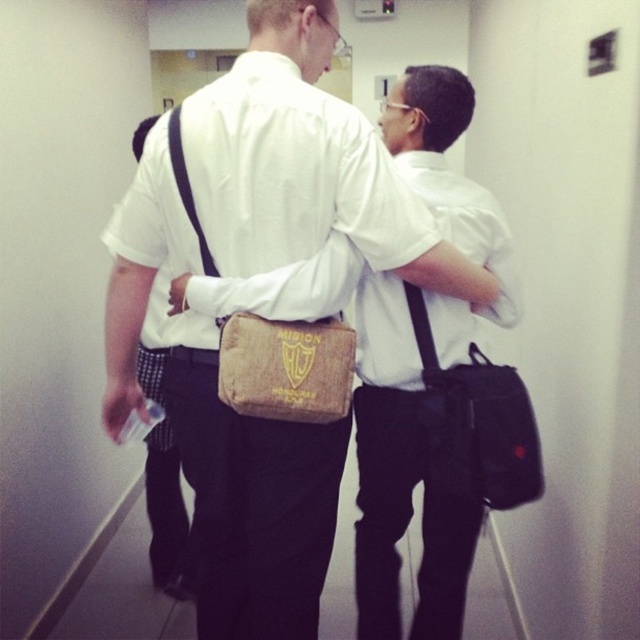
Is brown canvas bag at center wider than black fabric messenger bag at right?

Yes, brown canvas bag at center is wider than black fabric messenger bag at right.

Describe the element at coordinates (220, 435) in the screenshot. The width and height of the screenshot is (640, 640). I see `brown canvas bag at center` at that location.

This screenshot has height=640, width=640. In order to click on brown canvas bag at center in this screenshot , I will do `click(220, 435)`.

From the picture: Between white woven bag at center and matte brown bag at center, which one has more height?

Standing taller between the two is matte brown bag at center.

Between white woven bag at center and matte brown bag at center, which one is positioned higher?

white woven bag at center is above.

The width and height of the screenshot is (640, 640). I want to click on white woven bag at center, so click(x=291, y=172).

Which is more to the right, white woven bag at center or brown canvas pouch at center?

Positioned to the right is brown canvas pouch at center.

Is white woven bag at center thinner than brown canvas pouch at center?

Incorrect, white woven bag at center's width is not less than brown canvas pouch at center's.

Is point (330, 160) positioned after point (321, 416)?

No, it is in front of (321, 416).

Find the location of a particular element. This screenshot has width=640, height=640. white woven bag at center is located at coordinates (291, 172).